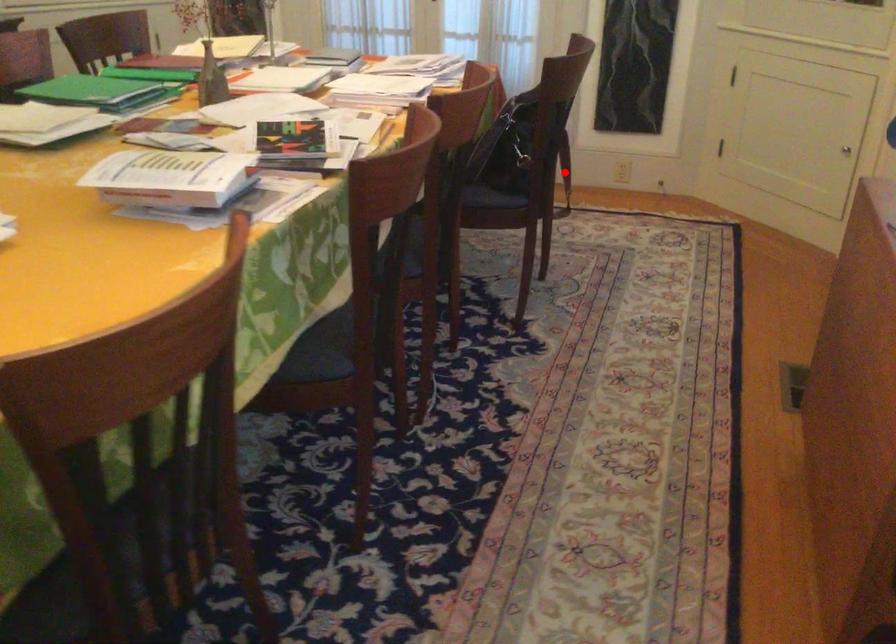
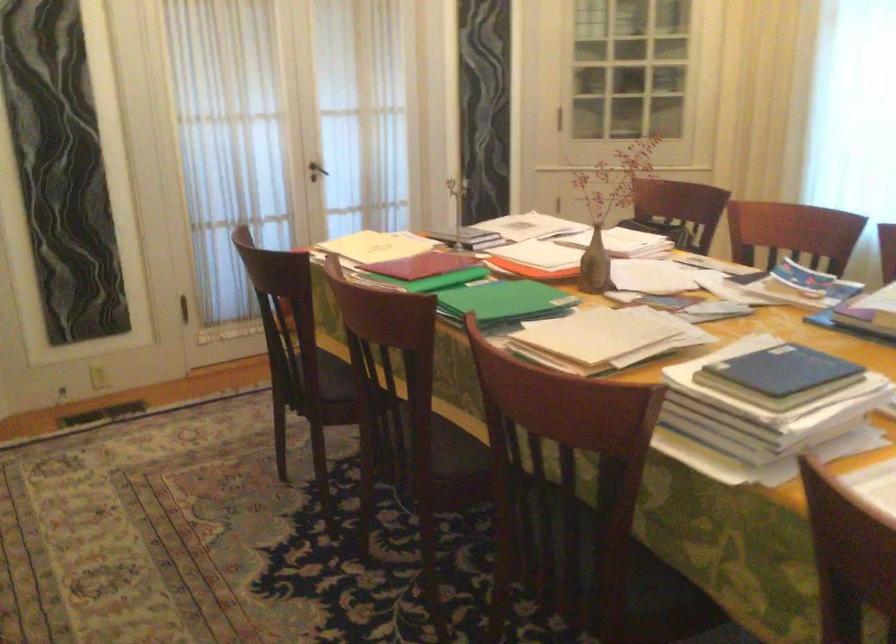
Question: I am providing you with two images of the same scene from different viewpoints. A red point is marked on the first image. Is the red point's position out of view in image 2?

Choices:
 (A) Yes
 (B) No

Answer: (A)